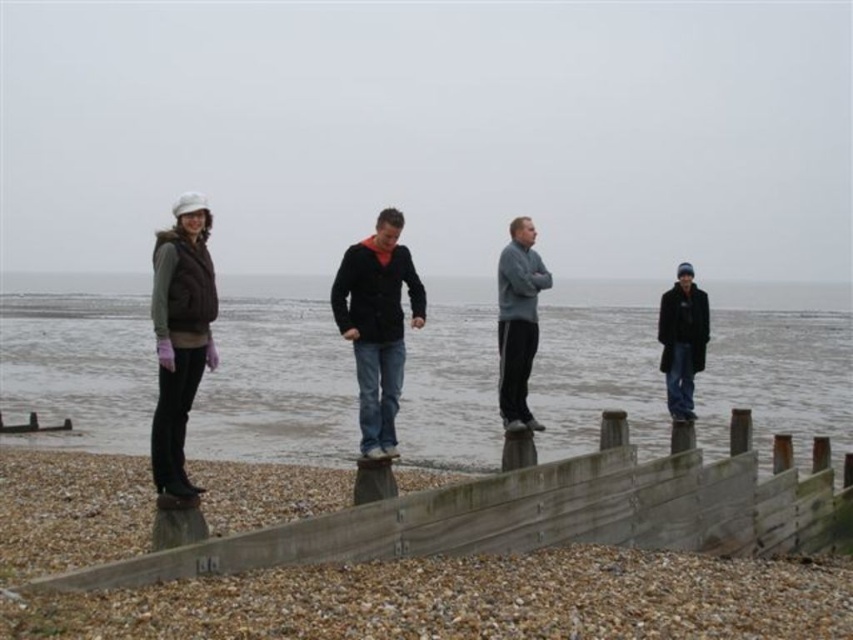
Based on the scene description, where is the gray water at center located in terms of its 2D coordinates?

The gray water at center is located at the 2D coordinates of point (x=276, y=385).

You are a photographer trying to capture a photo of the matte brown vest at left and the dark blue jeans at center. Since you want both subjects in the frame, which direction should you move to ensure both are visible?

Since the matte brown vest at left is to the left of the dark blue jeans at center, you should move to the right to ensure both are visible in the frame.